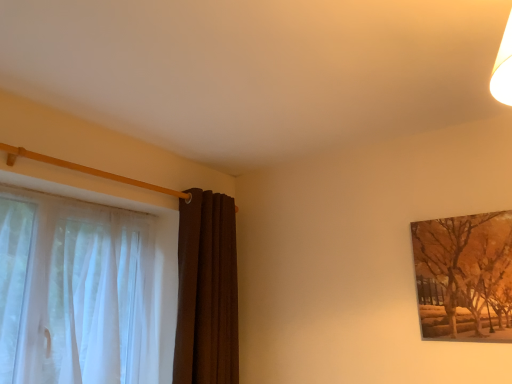
Question: Considering the relative sizes of brown velvet curtain at left, positioned as the 2th curtain in left-to-right order, and brown textured painting at upper right in the image provided, is brown velvet curtain at left, positioned as the 2th curtain in left-to-right order, thinner than brown textured painting at upper right?

Choices:
 (A) yes
 (B) no

Answer: (B)

Question: Does brown velvet curtain at left, positioned as the 2th curtain in left-to-right order, have a greater height compared to brown textured painting at upper right?

Choices:
 (A) yes
 (B) no

Answer: (A)

Question: Considering the relative sizes of brown velvet curtain at left, positioned as the 2th curtain in left-to-right order, and brown textured painting at upper right in the image provided, is brown velvet curtain at left, positioned as the 2th curtain in left-to-right order, bigger than brown textured painting at upper right?

Choices:
 (A) no
 (B) yes

Answer: (B)

Question: Would you say brown velvet curtain at left, the first curtain positioned from the right, is outside brown textured painting at upper right?

Choices:
 (A) no
 (B) yes

Answer: (B)

Question: From a real-world perspective, is brown velvet curtain at left, the first curtain positioned from the right, located higher than brown textured painting at upper right?

Choices:
 (A) yes
 (B) no

Answer: (B)

Question: Does point (505, 319) appear closer or farther from the camera than point (210, 359)?

Choices:
 (A) closer
 (B) farther

Answer: (A)

Question: Is brown textured painting at upper right taller or shorter than brown velvet curtain at left, positioned as the 2th curtain in left-to-right order?

Choices:
 (A) short
 (B) tall

Answer: (A)

Question: From the image's perspective, is brown textured painting at upper right above or below brown velvet curtain at left, positioned as the 2th curtain in left-to-right order?

Choices:
 (A) above
 (B) below

Answer: (A)

Question: In terms of size, does brown textured painting at upper right appear bigger or smaller than brown velvet curtain at left, positioned as the 2th curtain in left-to-right order?

Choices:
 (A) small
 (B) big

Answer: (A)

Question: In terms of height, does brown velvet curtain at left, positioned as the 2th curtain in left-to-right order, look taller or shorter compared to brown textured painting at upper right?

Choices:
 (A) tall
 (B) short

Answer: (A)

Question: From a real-world perspective, is brown velvet curtain at left, positioned as the 2th curtain in left-to-right order, above or below brown textured painting at upper right?

Choices:
 (A) below
 (B) above

Answer: (A)

Question: Which is correct: brown velvet curtain at left, positioned as the 2th curtain in left-to-right order, is inside brown textured painting at upper right, or outside of it?

Choices:
 (A) outside
 (B) inside

Answer: (A)

Question: Looking at their shapes, would you say brown velvet curtain at left, positioned as the 2th curtain in left-to-right order, is wider or thinner than brown textured painting at upper right?

Choices:
 (A) wide
 (B) thin

Answer: (A)

Question: Would you say sheer white curtain at left, the second curtain when ordered from right to left, is to the left or to the right of brown velvet curtain at left, positioned as the 2th curtain in left-to-right order, in the picture?

Choices:
 (A) right
 (B) left

Answer: (B)

Question: Considering the positions of sheer white curtain at left, positioned as the first curtain in left-to-right order, and brown velvet curtain at left, positioned as the 2th curtain in left-to-right order, in the image, is sheer white curtain at left, positioned as the first curtain in left-to-right order, wider or thinner than brown velvet curtain at left, positioned as the 2th curtain in left-to-right order,?

Choices:
 (A) wide
 (B) thin

Answer: (A)